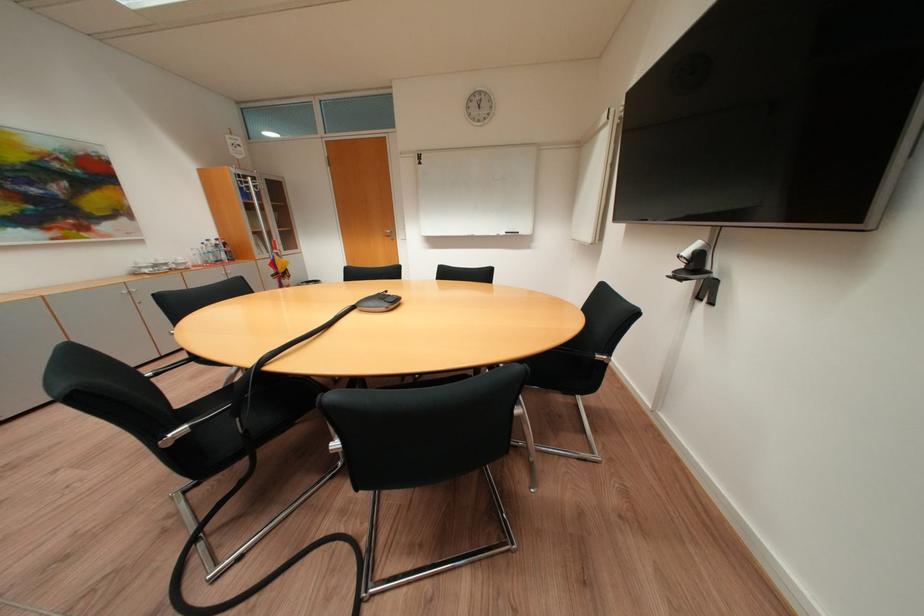
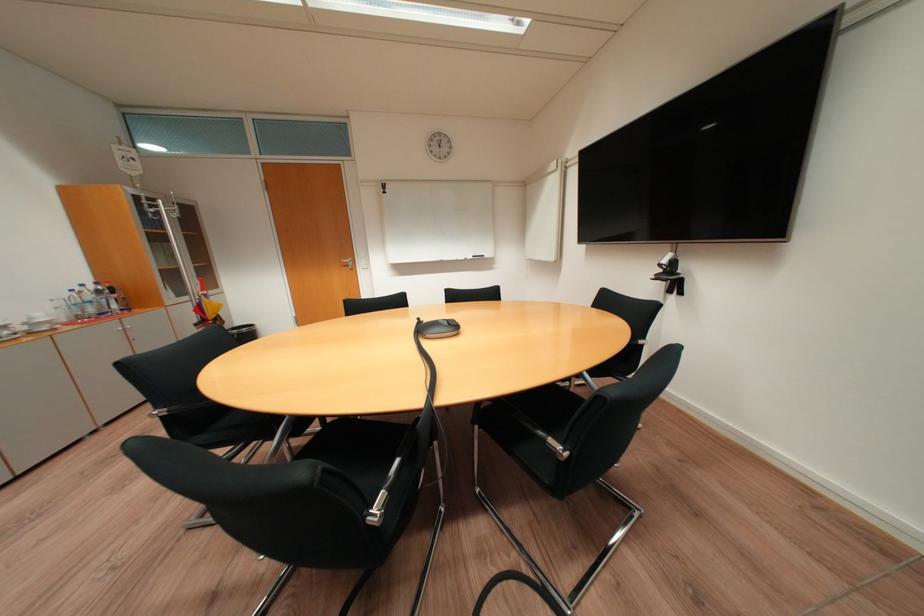
Find the pixel in the second image that matches (x=282, y=265) in the first image.

(208, 310)